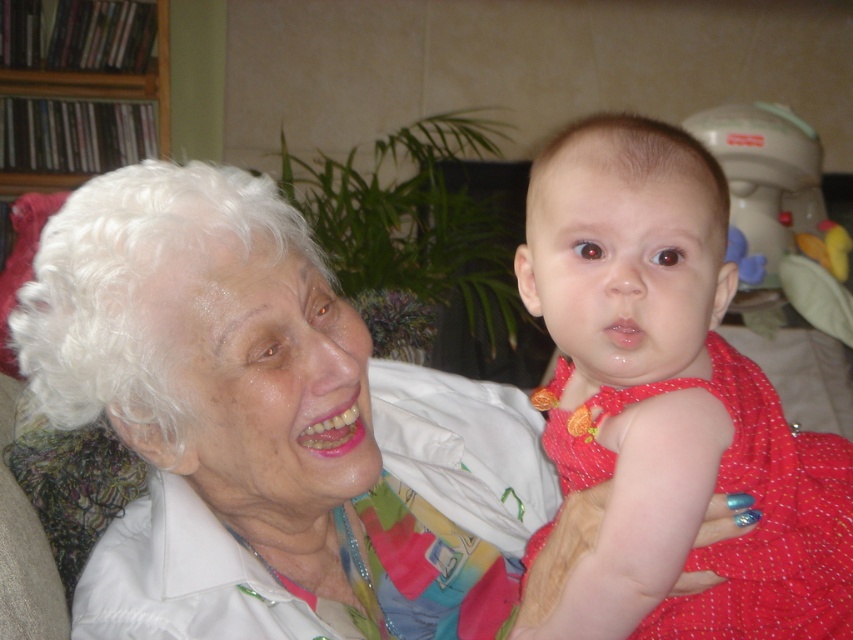
You are a photographer who wants to ensure both the white matte hair at upper left and the matte red dress at center are clearly visible in the photo. Based on their positions, which object should you focus on first to capture both effectively?

The white matte hair at upper left is located below the matte red dress at center. To capture both effectively, focus on the matte red dress at center first since it is higher up, ensuring the white matte hair at upper left, which is below it, remains in the frame.

Consider the image. You are a photographer trying to capture a closeup shot of the baby in the red dress. The camera you are using has a limited focus range. Given that the white matte hair at upper left is much taller than the matte red dress at center, will you need to adjust the camera focus to ensure the baby is in focus?

The white matte hair at upper left is much taller than the matte red dress at center, so the baby in the matte red dress at center is closer to the camera. Therefore, you should adjust the camera focus to the closer distance to ensure the baby is in focus.